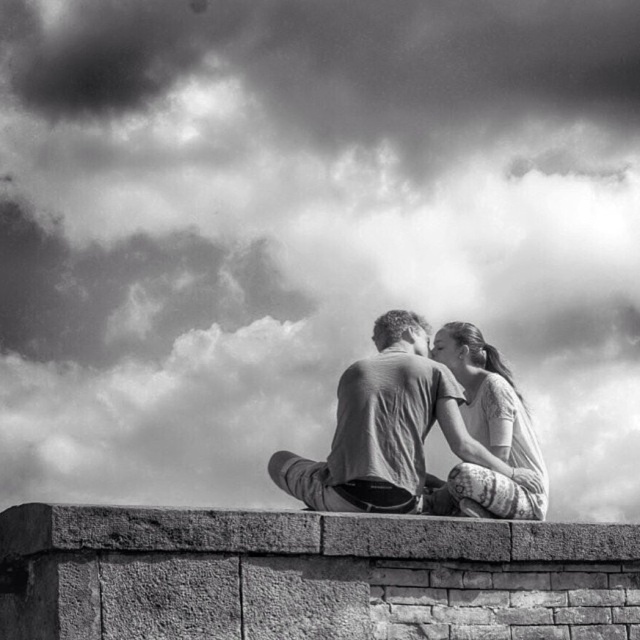
Between point (179, 532) and point (529, 515), which one is positioned behind?

Point (529, 515)

Is brick at center wider than patterned fabric dress at center?

Yes, brick at center is wider than patterned fabric dress at center.

Which is in front, point (60, 634) or point (515, 456)?

Point (60, 634)

At what (x,y) coordinates should I click in order to perform the action: click on brick at center. Please return your answer as a coordinate pair (x, y). The height and width of the screenshot is (640, 640). Looking at the image, I should click on (308, 577).

Is matte gray couple at center in front of patterned fabric dress at center?

No, matte gray couple at center is further to the viewer.

Is matte gray couple at center further to camera compared to patterned fabric dress at center?

Yes, it is behind patterned fabric dress at center.

Does point (406, 417) come in front of point (531, 452)?

Yes.

Locate an element on the screen. matte gray couple at center is located at coordinates (417, 436).

Identify the location of brick at center. (308, 577).

Who is more distant from viewer, (184,557) or (454,406)?

The point (454,406) is more distant.

You are a GUI agent. You are given a task and a screenshot of the screen. Output one action in this format:
    pyautogui.click(x=<x>, y=<y>)
    Task: Click on the brick at center
    The width and height of the screenshot is (640, 640).
    Given the screenshot: What is the action you would take?
    pyautogui.click(x=308, y=577)

Locate an element on the screen. The image size is (640, 640). brick at center is located at coordinates (308, 577).